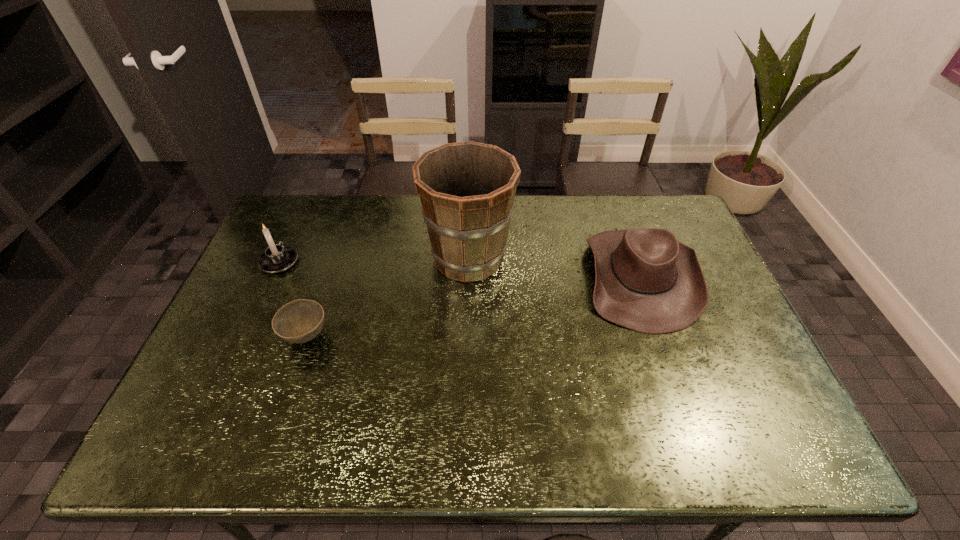
The height and width of the screenshot is (540, 960). In order to click on vacant space at the right edge in this screenshot , I will do `click(753, 383)`.

In the image, there is a desktop. At what (x,y) coordinates should I click in order to perform the action: click on free space at the near left corner. Please return your answer as a coordinate pair (x, y). The image size is (960, 540). Looking at the image, I should click on (189, 448).

The height and width of the screenshot is (540, 960). I want to click on unoccupied area between the rightmost object and the shortest object, so click(x=474, y=307).

This screenshot has width=960, height=540. I want to click on free space between the cowboy hat and the third object from left to right, so click(x=555, y=267).

Find the location of `unoccupied area between the cowboy hat and the bowl`. unoccupied area between the cowboy hat and the bowl is located at coordinates (474, 307).

The height and width of the screenshot is (540, 960). Find the location of `unoccupied area between the tallest object and the shortest object`. unoccupied area between the tallest object and the shortest object is located at coordinates (388, 298).

At what (x,y) coordinates should I click in order to perform the action: click on vacant region between the bowl and the cowboy hat. Please return your answer as a coordinate pair (x, y). Looking at the image, I should click on (474, 307).

Locate an element on the screen. This screenshot has height=540, width=960. vacant space that is in between the tallest object and the candle holder is located at coordinates (374, 260).

Identify the location of vacant area that lies between the candle holder and the second object from right to left. (374, 260).

The image size is (960, 540). I want to click on free space between the third object from left to right and the candle holder, so click(x=374, y=260).